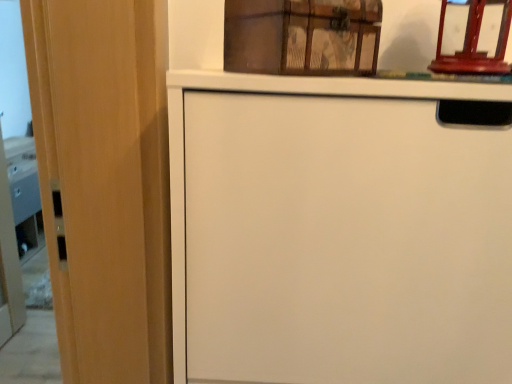
The height and width of the screenshot is (384, 512). What do you see at coordinates (302, 37) in the screenshot? I see `wooden trunk at upper center, which is counted as the second cabinetry, starting from the bottom` at bounding box center [302, 37].

Identify the location of wooden trunk at upper center, which is counted as the second cabinetry, starting from the bottom. The height and width of the screenshot is (384, 512). (302, 37).

The width and height of the screenshot is (512, 384). I want to click on white matte cabinet at center, the second cabinetry in the top-to-bottom sequence, so click(340, 229).

What do you see at coordinates (340, 229) in the screenshot? I see `white matte cabinet at center, the second cabinetry in the top-to-bottom sequence` at bounding box center [340, 229].

The width and height of the screenshot is (512, 384). In order to click on wooden trunk at upper center, which is counted as the second cabinetry, starting from the bottom in this screenshot , I will do `click(302, 37)`.

Based on the photo, is white matte cabinet at center, the first cabinetry when ordered from bottom to top, to the left of wooden trunk at upper center, placed as the first cabinetry when sorted from top to bottom, from the viewer's perspective?

No.

Which object is more forward, white matte cabinet at center, the second cabinetry in the top-to-bottom sequence, or wooden trunk at upper center, placed as the first cabinetry when sorted from top to bottom?

white matte cabinet at center, the second cabinetry in the top-to-bottom sequence.

Does point (243, 154) come closer to viewer compared to point (326, 67)?

Yes, it is.

From the image's perspective, is white matte cabinet at center, the first cabinetry when ordered from bottom to top, located above or below wooden trunk at upper center, which is counted as the second cabinetry, starting from the bottom?

Clearly, from the image's perspective, white matte cabinet at center, the first cabinetry when ordered from bottom to top, is below wooden trunk at upper center, which is counted as the second cabinetry, starting from the bottom.

From a real-world perspective, is white matte cabinet at center, the second cabinetry in the top-to-bottom sequence, physically below wooden trunk at upper center, placed as the first cabinetry when sorted from top to bottom?

Yes.

Is white matte cabinet at center, the second cabinetry in the top-to-bottom sequence, wider or thinner than wooden trunk at upper center, placed as the first cabinetry when sorted from top to bottom?

Considering their sizes, white matte cabinet at center, the second cabinetry in the top-to-bottom sequence, looks broader than wooden trunk at upper center, placed as the first cabinetry when sorted from top to bottom.

Is white matte cabinet at center, the first cabinetry when ordered from bottom to top, taller or shorter than wooden trunk at upper center, placed as the first cabinetry when sorted from top to bottom?

Clearly, white matte cabinet at center, the first cabinetry when ordered from bottom to top, is taller compared to wooden trunk at upper center, placed as the first cabinetry when sorted from top to bottom.

Between white matte cabinet at center, the first cabinetry when ordered from bottom to top, and wooden trunk at upper center, placed as the first cabinetry when sorted from top to bottom, which one has larger size?

With larger size is white matte cabinet at center, the first cabinetry when ordered from bottom to top.

Is white matte cabinet at center, the first cabinetry when ordered from bottom to top, situated inside wooden trunk at upper center, which is counted as the second cabinetry, starting from the bottom, or outside?

The correct answer is: outside.

Is white matte cabinet at center, the first cabinetry when ordered from bottom to top, far from wooden trunk at upper center, placed as the first cabinetry when sorted from top to bottom?

white matte cabinet at center, the first cabinetry when ordered from bottom to top, is actually quite close to wooden trunk at upper center, placed as the first cabinetry when sorted from top to bottom.

Does white matte cabinet at center, the second cabinetry in the top-to-bottom sequence, turn towards wooden trunk at upper center, placed as the first cabinetry when sorted from top to bottom?

No.

I want to click on cabinetry in front of the wooden trunk at upper center, which is counted as the second cabinetry, starting from the bottom, so click(x=340, y=229).

Is wooden trunk at upper center, which is counted as the second cabinetry, starting from the bottom, to the right of white matte cabinet at center, the second cabinetry in the top-to-bottom sequence, from the viewer's perspective?

Incorrect, wooden trunk at upper center, which is counted as the second cabinetry, starting from the bottom, is not on the right side of white matte cabinet at center, the second cabinetry in the top-to-bottom sequence.

Is wooden trunk at upper center, which is counted as the second cabinetry, starting from the bottom, in front of or behind white matte cabinet at center, the second cabinetry in the top-to-bottom sequence, in the image?

wooden trunk at upper center, which is counted as the second cabinetry, starting from the bottom, is behind white matte cabinet at center, the second cabinetry in the top-to-bottom sequence.

Is point (367, 9) closer to viewer compared to point (415, 164)?

That is False.

From the image's perspective, is wooden trunk at upper center, placed as the first cabinetry when sorted from top to bottom, beneath white matte cabinet at center, the first cabinetry when ordered from bottom to top?

Incorrect, from the image's perspective, wooden trunk at upper center, placed as the first cabinetry when sorted from top to bottom, is higher than white matte cabinet at center, the first cabinetry when ordered from bottom to top.

From a real-world perspective, is wooden trunk at upper center, placed as the first cabinetry when sorted from top to bottom, over white matte cabinet at center, the second cabinetry in the top-to-bottom sequence?

Yes, from a real-world perspective, wooden trunk at upper center, placed as the first cabinetry when sorted from top to bottom, is over white matte cabinet at center, the second cabinetry in the top-to-bottom sequence

Looking at their sizes, would you say wooden trunk at upper center, which is counted as the second cabinetry, starting from the bottom, is wider or thinner than white matte cabinet at center, the first cabinetry when ordered from bottom to top?

In the image, wooden trunk at upper center, which is counted as the second cabinetry, starting from the bottom, appears to be more narrow than white matte cabinet at center, the first cabinetry when ordered from bottom to top.

Who is taller, wooden trunk at upper center, placed as the first cabinetry when sorted from top to bottom, or white matte cabinet at center, the second cabinetry in the top-to-bottom sequence?

white matte cabinet at center, the second cabinetry in the top-to-bottom sequence.

Can you confirm if wooden trunk at upper center, placed as the first cabinetry when sorted from top to bottom, is smaller than white matte cabinet at center, the second cabinetry in the top-to-bottom sequence?

Yes, wooden trunk at upper center, placed as the first cabinetry when sorted from top to bottom, is smaller than white matte cabinet at center, the second cabinetry in the top-to-bottom sequence.

Is white matte cabinet at center, the second cabinetry in the top-to-bottom sequence, located within wooden trunk at upper center, which is counted as the second cabinetry, starting from the bottom?

No, white matte cabinet at center, the second cabinetry in the top-to-bottom sequence, is not surrounded by wooden trunk at upper center, which is counted as the second cabinetry, starting from the bottom.

Are wooden trunk at upper center, placed as the first cabinetry when sorted from top to bottom, and white matte cabinet at center, the second cabinetry in the top-to-bottom sequence, making contact?

No, wooden trunk at upper center, placed as the first cabinetry when sorted from top to bottom, is not next to white matte cabinet at center, the second cabinetry in the top-to-bottom sequence.

Is white matte cabinet at center, the first cabinetry when ordered from bottom to top, at the back of wooden trunk at upper center, placed as the first cabinetry when sorted from top to bottom?

wooden trunk at upper center, placed as the first cabinetry when sorted from top to bottom, is not turned away from white matte cabinet at center, the first cabinetry when ordered from bottom to top.

Measure the distance from wooden trunk at upper center, which is counted as the second cabinetry, starting from the bottom, to white matte cabinet at center, the first cabinetry when ordered from bottom to top.

8.56 inches.

At what (x,y) coordinates should I click in order to perform the action: click on cabinetry behind the white matte cabinet at center, the second cabinetry in the top-to-bottom sequence. Please return your answer as a coordinate pair (x, y). Looking at the image, I should click on (302, 37).

At what (x,y) coordinates should I click in order to perform the action: click on cabinetry below the wooden trunk at upper center, placed as the first cabinetry when sorted from top to bottom (from the image's perspective). Please return your answer as a coordinate pair (x, y). The height and width of the screenshot is (384, 512). Looking at the image, I should click on (340, 229).

Where is `cabinetry above the white matte cabinet at center, the first cabinetry when ordered from bottom to top (from a real-world perspective)`? The height and width of the screenshot is (384, 512). cabinetry above the white matte cabinet at center, the first cabinetry when ordered from bottom to top (from a real-world perspective) is located at coordinates (302, 37).